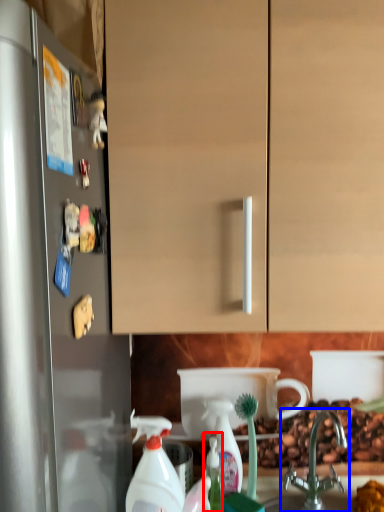
Question: Which point is closer to the camera, bottle (highlighted by a red box) or tap (highlighted by a blue box)?

Choices:
 (A) bottle
 (B) tap

Answer: (B)